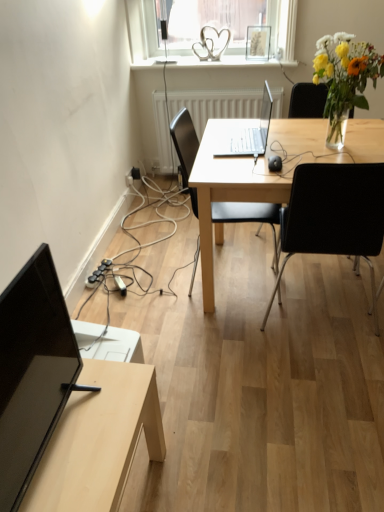
The height and width of the screenshot is (512, 384). What do you see at coordinates (344, 79) in the screenshot?
I see `translucent glass vase at upper right` at bounding box center [344, 79].

What do you see at coordinates (32, 371) in the screenshot? I see `black glossy monitor at lower left` at bounding box center [32, 371].

What is the approximate height of light wood table at lower left?

It is 17.92 inches.

Locate an element on the screen. Image resolution: width=384 pixels, height=512 pixels. black rubber extension cord at lower left is located at coordinates (98, 274).

At what (x,y) coordinates should I click in order to perform the action: click on silver metallic laptop at center. Please return your answer as a coordinate pair (x, y). The image size is (384, 512). Looking at the image, I should click on (248, 133).

Find the location of a particular element. This screenshot has width=384, height=512. light wood desk at center is located at coordinates (268, 170).

You are a GUI agent. You are given a task and a screenshot of the screen. Output one action in this format:
    pyautogui.click(x=<x>, y=<y>)
    Task: Click on the translucent glass vase at upper right
    The width and height of the screenshot is (384, 512).
    Given the screenshot: What is the action you would take?
    pyautogui.click(x=344, y=79)

Based on their sizes in the image, would you say light wood desk at center is bigger or smaller than silver metallic laptop at center?

In the image, light wood desk at center appears to be larger than silver metallic laptop at center.

From a real-world perspective, which is physically above, light wood desk at center or silver metallic laptop at center?

silver metallic laptop at center, from a real-world perspective.

Which of these two, light wood desk at center or silver metallic laptop at center, is wider?

Wider between the two is light wood desk at center.

Would you say light wood desk at center is inside or outside silver metallic laptop at center?

light wood desk at center lies outside silver metallic laptop at center.

Identify the location of computer monitor lying on the left of light wood desk at center. (32, 371).

From a real-world perspective, relative to light wood desk at center, is black glossy monitor at lower left vertically above or below?

black glossy monitor at lower left is situated higher than light wood desk at center in the real world.

Considering the relative sizes of black glossy monitor at lower left and light wood desk at center in the image provided, is black glossy monitor at lower left wider than light wood desk at center?

No.

Which is closer to the camera, (47,290) or (273,193)?

Point (47,290) is closer to the camera than point (273,193).

Is black rubber extension cord at lower left shorter than light wood table at lower left?

Indeed, black rubber extension cord at lower left has a lesser height compared to light wood table at lower left.

Is point (105, 271) positioned behind point (96, 375)?

Yes, it is behind point (96, 375).

Can you confirm if silver metallic laptop at center is wider than translucent glass vase at upper right?

In fact, silver metallic laptop at center might be narrower than translucent glass vase at upper right.

From a real-world perspective, does silver metallic laptop at center stand above translucent glass vase at upper right?

No, from a real-world perspective, silver metallic laptop at center is not on top of translucent glass vase at upper right.

Does point (242, 142) appear closer or farther from the camera than point (337, 77)?

Clearly, point (242, 142) is more distant from the camera than point (337, 77).

Is silver metallic laptop at center not near translucent glass vase at upper right?

silver metallic laptop at center is actually quite close to translucent glass vase at upper right.

Between light wood table at lower left and black glossy monitor at lower left, which one has smaller width?

black glossy monitor at lower left is thinner.

The height and width of the screenshot is (512, 384). Find the location of `computer monitor above the light wood table at lower left (from the image's perspective)`. computer monitor above the light wood table at lower left (from the image's perspective) is located at coordinates click(32, 371).

Relative to black glossy monitor at lower left, is light wood table at lower left in front or behind?

light wood table at lower left is positioned farther from the viewer than black glossy monitor at lower left.

Is black glossy monitor at lower left at the left side of black plastic chair at center, placed as the second chair when sorted from left to right?

Indeed, black glossy monitor at lower left is positioned on the left side of black plastic chair at center, placed as the second chair when sorted from left to right.

Can black plastic chair at center, placed as the second chair when sorted from left to right, be found inside black glossy monitor at lower left?

Actually, black plastic chair at center, placed as the second chair when sorted from left to right, is outside black glossy monitor at lower left.

Considering the sizes of objects black glossy monitor at lower left and black plastic chair at center, placed as the second chair when sorted from left to right, in the image provided, who is bigger, black glossy monitor at lower left or black plastic chair at center, placed as the second chair when sorted from left to right,?

black plastic chair at center, placed as the second chair when sorted from left to right, is bigger.

This screenshot has width=384, height=512. In order to click on the 1st chair located beneath the black glossy monitor at lower left (from a real-world perspective) in this screenshot , I will do tap(334, 215).

Considering the positions of point (98, 278) and point (371, 60), is point (98, 278) closer or farther from the camera than point (371, 60)?

Point (98, 278) is positioned farther from the camera compared to point (371, 60).

The height and width of the screenshot is (512, 384). I want to click on extension cord below the translucent glass vase at upper right (from a real-world perspective), so click(98, 274).

Is black rubber extension cord at lower left bigger than translucent glass vase at upper right?

Actually, black rubber extension cord at lower left might be smaller than translucent glass vase at upper right.

At what (x,y) coordinates should I click in order to perform the action: click on desk on the right of silver metallic laptop at center. Please return your answer as a coordinate pair (x, y). This screenshot has width=384, height=512. Looking at the image, I should click on (268, 170).

Image resolution: width=384 pixels, height=512 pixels. Identify the location of desk above the black glossy monitor at lower left (from the image's perspective). (268, 170).

When comparing their distances from light wood table at lower left, does light wood desk at center or silver metallic laptop at center seem further?

silver metallic laptop at center.

Estimate the real-world distances between objects in this image. Which object is closer to silver metallic laptop at center, light wood table at lower left or black plastic chair at center, the first chair in the right-to-left sequence?

Based on the image, black plastic chair at center, the first chair in the right-to-left sequence, appears to be nearer to silver metallic laptop at center.

Estimate the real-world distances between objects in this image. Which object is further from black glossy monitor at lower left, white textured radiator at center or silver metallic laptop at center?

white textured radiator at center is further to black glossy monitor at lower left.

Based on their spatial positions, is black leather chair at center, the first chair in the left-to-right sequence, or white textured radiator at center further from translucent glass vase at upper right?

white textured radiator at center is positioned further to the anchor translucent glass vase at upper right.

Estimate the real-world distances between objects in this image. Which object is closer to black plastic chair at center, the first chair in the right-to-left sequence, silver metallic laptop at center or translucent glass vase at upper right?

Among the two, silver metallic laptop at center is located nearer to black plastic chair at center, the first chair in the right-to-left sequence.

Based on the photo, estimate the real-world distances between objects in this image. Which object is closer to translucent glass vase at upper right, white textured radiator at center or silver metallic laptop at center?

silver metallic laptop at center.

Looking at the image, which one is located closer to white textured radiator at center, light wood table at lower left or silver metallic laptop at center?

Based on the image, silver metallic laptop at center appears to be nearer to white textured radiator at center.

Looking at the image, which one is located further to translucent glass vase at upper right, white textured radiator at center or light wood table at lower left?

Among the two, light wood table at lower left is located further to translucent glass vase at upper right.

The height and width of the screenshot is (512, 384). I want to click on extension cord between light wood desk at center and white textured radiator at center from front to back, so click(x=98, y=274).

At what (x,y) coordinates should I click in order to perform the action: click on extension cord between black leather chair at center, the first chair in the left-to-right sequence, and white textured radiator at center in the front-back direction. Please return your answer as a coordinate pair (x, y). The width and height of the screenshot is (384, 512). Looking at the image, I should click on (98, 274).

The width and height of the screenshot is (384, 512). I want to click on chair between silver metallic laptop at center and light wood desk at center vertically, so click(248, 216).

I want to click on laptop positioned between light wood table at lower left and white textured radiator at center from near to far, so click(x=248, y=133).